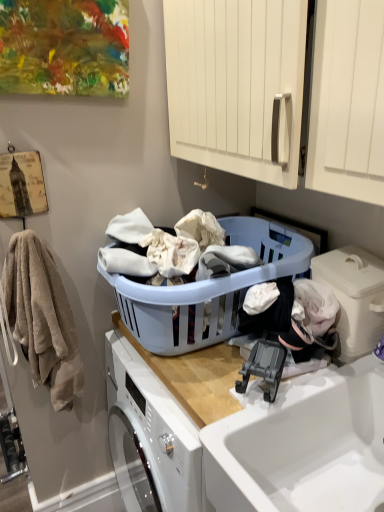
Question: Can you confirm if beige soft towel at left is smaller than white glossy sink at lower right?

Choices:
 (A) yes
 (B) no

Answer: (A)

Question: From a real-world perspective, is beige soft towel at left under white glossy sink at lower right?

Choices:
 (A) no
 (B) yes

Answer: (A)

Question: Is beige soft towel at left taller than white glossy sink at lower right?

Choices:
 (A) yes
 (B) no

Answer: (A)

Question: From a real-world perspective, is beige soft towel at left physically above white glossy sink at lower right?

Choices:
 (A) yes
 (B) no

Answer: (A)

Question: From the image's perspective, would you say beige soft towel at left is shown under white glossy sink at lower right?

Choices:
 (A) yes
 (B) no

Answer: (B)

Question: Can you confirm if beige soft towel at left is bigger than white glossy sink at lower right?

Choices:
 (A) yes
 (B) no

Answer: (B)

Question: Considering the relative positions of white plastic container at lower right and light blue plastic laundry basket at center in the image provided, is white plastic container at lower right to the right of light blue plastic laundry basket at center from the viewer's perspective?

Choices:
 (A) yes
 (B) no

Answer: (A)

Question: Can you confirm if white plastic container at lower right is thinner than light blue plastic laundry basket at center?

Choices:
 (A) no
 (B) yes

Answer: (B)

Question: Considering the relative positions of white plastic container at lower right and light blue plastic laundry basket at center in the image provided, is white plastic container at lower right to the left of light blue plastic laundry basket at center from the viewer's perspective?

Choices:
 (A) no
 (B) yes

Answer: (A)

Question: Does white plastic container at lower right touch light blue plastic laundry basket at center?

Choices:
 (A) no
 (B) yes

Answer: (A)

Question: From a real-world perspective, is white plastic container at lower right positioned over light blue plastic laundry basket at center based on gravity?

Choices:
 (A) yes
 (B) no

Answer: (A)

Question: Does white plastic container at lower right have a larger size compared to light blue plastic laundry basket at center?

Choices:
 (A) yes
 (B) no

Answer: (B)

Question: Is beige soft towel at left to the left of white plastic container at lower right from the viewer's perspective?

Choices:
 (A) yes
 (B) no

Answer: (A)